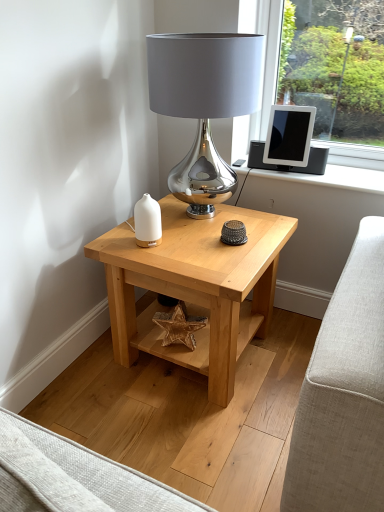
I want to click on vacant area on top of light wood table at center (from a real-world perspective), so click(x=196, y=238).